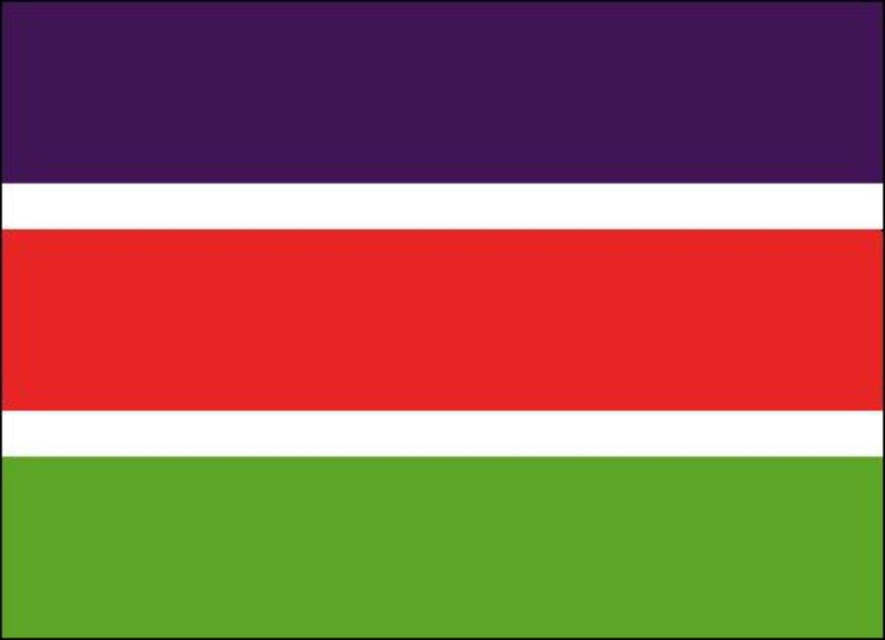
You are standing 1.34 meters away from the flag. If you move forward 0.5 meters, will the point at coordinates point (x=468, y=147) become closer to you?

Yes, because moving forward reduces the distance between you and the point at coordinates point (x=468, y=147).

You are an astronaut floating in space and see a flag with three horizontal stripes of purple, red, and green. You notice two points on the flag labeled as point (483, 145) and point (859, 404). If you want to reach the point that is closer to you, which one should you aim for?

Point (859, 404) is closer to you, so you should aim for point (859, 404).

You are designing a flag display case that requires the vertical space between the purple matte rectangle at upper left and the green matte rectangle at bottom to be exactly 15 inches. Based on the flag shown, will the current vertical spacing between them meet this requirement?

The vertical spacing between the purple matte rectangle at upper left and the green matte rectangle at bottom is 15.60 inches, which exceeds the required 15 inches. Therefore, the current spacing meets the requirement.